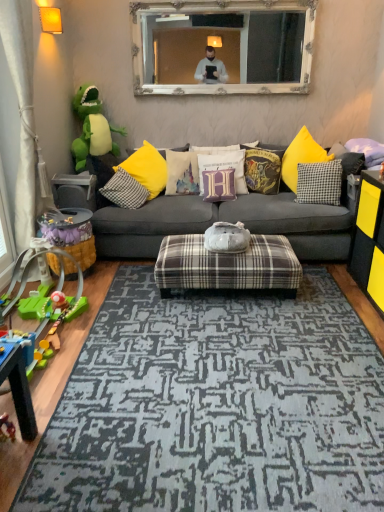
Question: From a real-world perspective, is plastic green toy at left, which is the second toy in bottom-to-top order, beneath green plush dinosaur at left, which is the fourth toy from front to back?

Choices:
 (A) yes
 (B) no

Answer: (A)

Question: Is plastic green toy at left, which is counted as the third toy, starting from the back, turned away from green plush dinosaur at left, marked as the 4th toy in a bottom-to-top arrangement?

Choices:
 (A) no
 (B) yes

Answer: (A)

Question: Is plastic green toy at left, which is counted as the third toy, starting from the back, further to camera compared to green plush dinosaur at left, marked as the 4th toy in a bottom-to-top arrangement?

Choices:
 (A) no
 (B) yes

Answer: (A)

Question: Is plastic green toy at left, which ranks as the second toy in front-to-back order, bigger than green plush dinosaur at left, marked as the 4th toy in a bottom-to-top arrangement?

Choices:
 (A) no
 (B) yes

Answer: (B)

Question: Is the surface of plastic green toy at left, which is counted as the third toy, starting from the back, in direct contact with green plush dinosaur at left, arranged as the 1th toy when viewed from the back?

Choices:
 (A) yes
 (B) no

Answer: (B)

Question: Is plastic green toy at left, which ranks as the second toy in front-to-back order, taller than green plush dinosaur at left, arranged as the 1th toy when viewed from the back?

Choices:
 (A) yes
 (B) no

Answer: (B)

Question: Is purple fabric pillow at upper right, positioned as the first pillow in right-to-left order, thinner than blue-gray textured rug at center?

Choices:
 (A) no
 (B) yes

Answer: (B)

Question: From a real-world perspective, is purple fabric pillow at upper right, positioned as the first pillow in right-to-left order, below blue-gray textured rug at center?

Choices:
 (A) no
 (B) yes

Answer: (A)

Question: Can you confirm if purple fabric pillow at upper right, which ranks as the seventh pillow in left-to-right order, is positioned to the right of blue-gray textured rug at center?

Choices:
 (A) yes
 (B) no

Answer: (A)

Question: From the image's perspective, is purple fabric pillow at upper right, which ranks as the seventh pillow in left-to-right order, below blue-gray textured rug at center?

Choices:
 (A) yes
 (B) no

Answer: (B)

Question: Can you confirm if purple fabric pillow at upper right, positioned as the first pillow in right-to-left order, is smaller than blue-gray textured rug at center?

Choices:
 (A) yes
 (B) no

Answer: (A)

Question: Is purple fabric pillow at upper right, positioned as the first pillow in right-to-left order, oriented away from blue-gray textured rug at center?

Choices:
 (A) no
 (B) yes

Answer: (A)

Question: Is black matte dresser at right far away from plaid fabric ottoman at center, marked as the 2th table in a top-to-bottom arrangement?

Choices:
 (A) yes
 (B) no

Answer: (B)